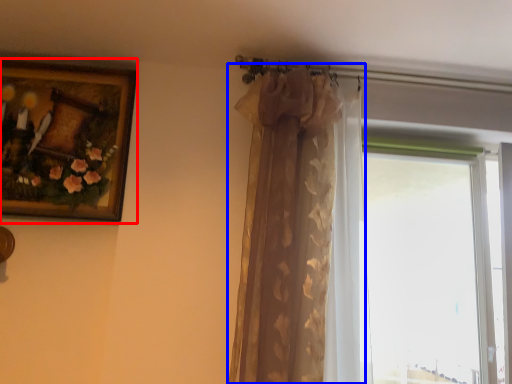
Question: Which object is closer to the camera taking this photo, picture frame (highlighted by a red box) or curtain (highlighted by a blue box)?

Choices:
 (A) picture frame
 (B) curtain

Answer: (B)